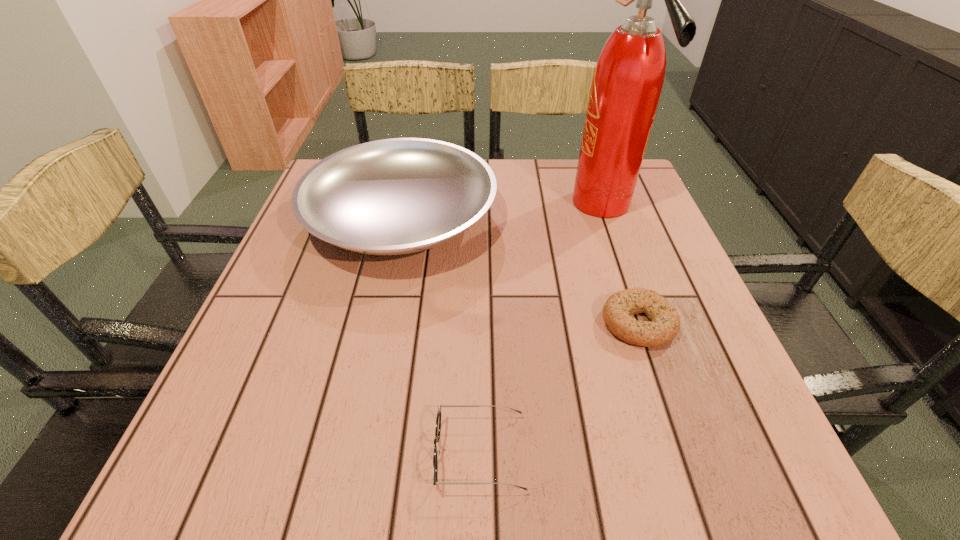
Find the location of `fire extinguisher present at the far edge`. fire extinguisher present at the far edge is located at coordinates (627, 82).

Locate an element on the screen. This screenshot has height=540, width=960. bedpan that is at the far edge is located at coordinates (395, 196).

The width and height of the screenshot is (960, 540). Identify the location of object located at the near edge. (438, 420).

Where is `object present at the left edge`? object present at the left edge is located at coordinates (395, 196).

Identify the location of fire extinguisher at the right edge. This screenshot has width=960, height=540. (627, 82).

What are the coordinates of `bagel that is at the right edge` in the screenshot? It's located at (665, 324).

At what (x,y) coordinates should I click in order to perform the action: click on object at the far left corner. Please return your answer as a coordinate pair (x, y). The height and width of the screenshot is (540, 960). Looking at the image, I should click on (395, 196).

Where is `object at the far right corner`? object at the far right corner is located at coordinates (627, 82).

This screenshot has height=540, width=960. Identify the location of vacant space at the far edge of the desktop. (561, 163).

Where is `free location at the near edge of the desktop`? free location at the near edge of the desktop is located at coordinates (303, 469).